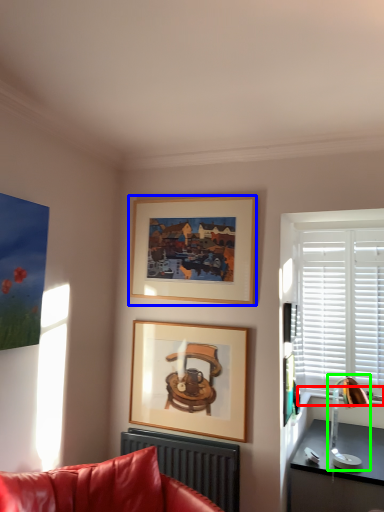
Question: Considering the real-world distances, which object is closest to window sill (highlighted by a red box)? picture frame (highlighted by a blue box) or table lamp (highlighted by a green box).

Choices:
 (A) picture frame
 (B) table lamp

Answer: (B)